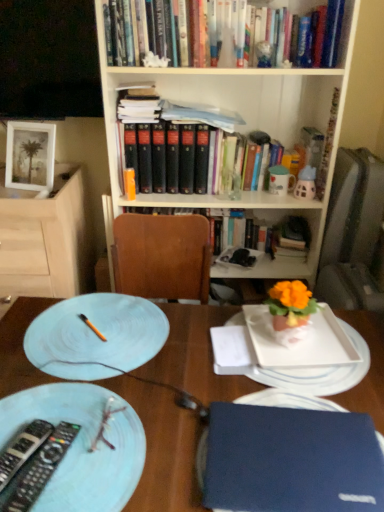
The image size is (384, 512). Find the location of `free spot above blue glossy plate at lower left, positioned as the second plate in back-to-front order (from a real-world perspective)`. free spot above blue glossy plate at lower left, positioned as the second plate in back-to-front order (from a real-world perspective) is located at coordinates (61, 443).